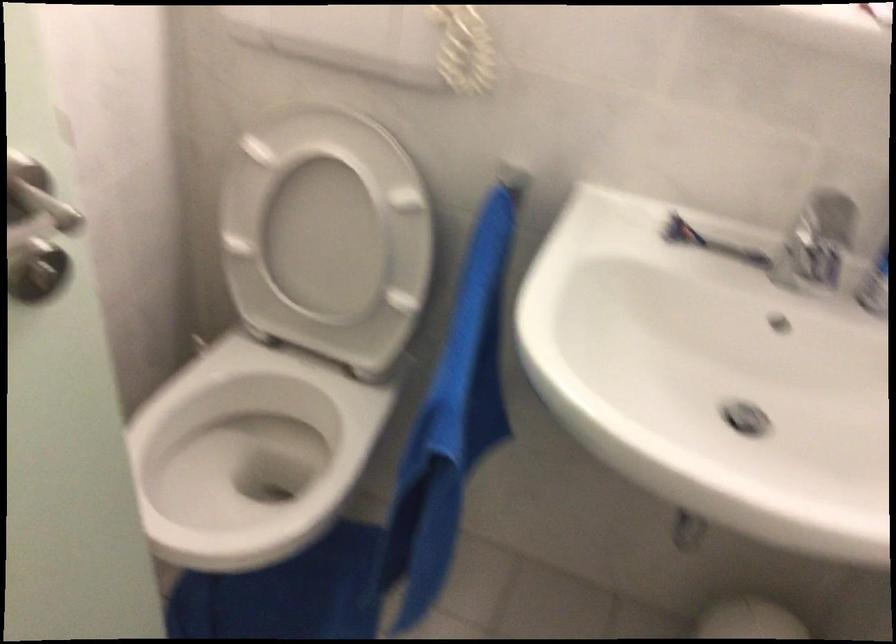
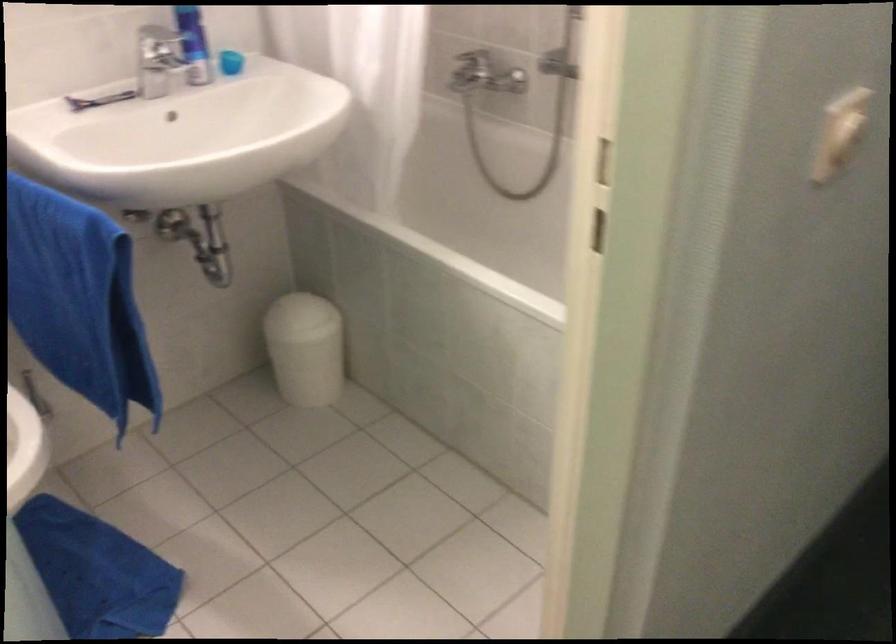
In the second image, find the point that corresponds to pixel 769 348 in the first image.

(183, 137)